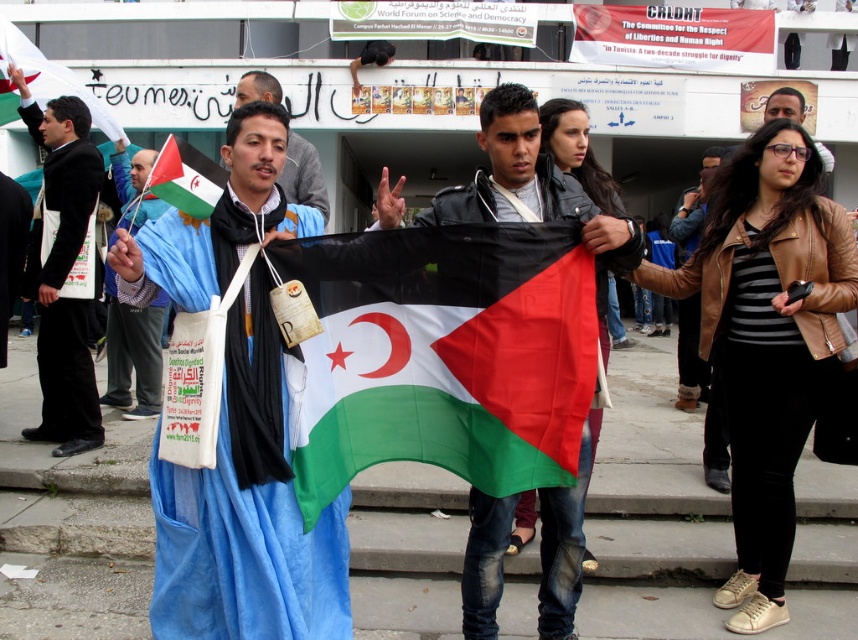
Is polyester flag at center to the right of blue fabric at center from the viewer's perspective?

Indeed, polyester flag at center is positioned on the right side of blue fabric at center.

Between point (379, 428) and point (240, 104), which one is positioned behind?

The point (240, 104) is more distant.

Find the location of a particular element. The height and width of the screenshot is (640, 858). polyester flag at center is located at coordinates (440, 355).

Can you confirm if white fabric flag at upper left is positioned above green fabric flag at center?

Yes.

Who is taller, white fabric flag at upper left or green fabric flag at center?

white fabric flag at upper left is taller.

Is point (7, 90) more distant than point (210, 180)?

Yes, point (7, 90) is behind point (210, 180).

The height and width of the screenshot is (640, 858). I want to click on white fabric flag at upper left, so click(44, 81).

Does point (437, 419) lie in front of point (488, 209)?

Yes, it is in front of point (488, 209).

Is point (303, 500) positioned behind point (579, 461)?

No.

Locate an element on the screen. Image resolution: width=858 pixels, height=640 pixels. polyester flag at center is located at coordinates (440, 355).